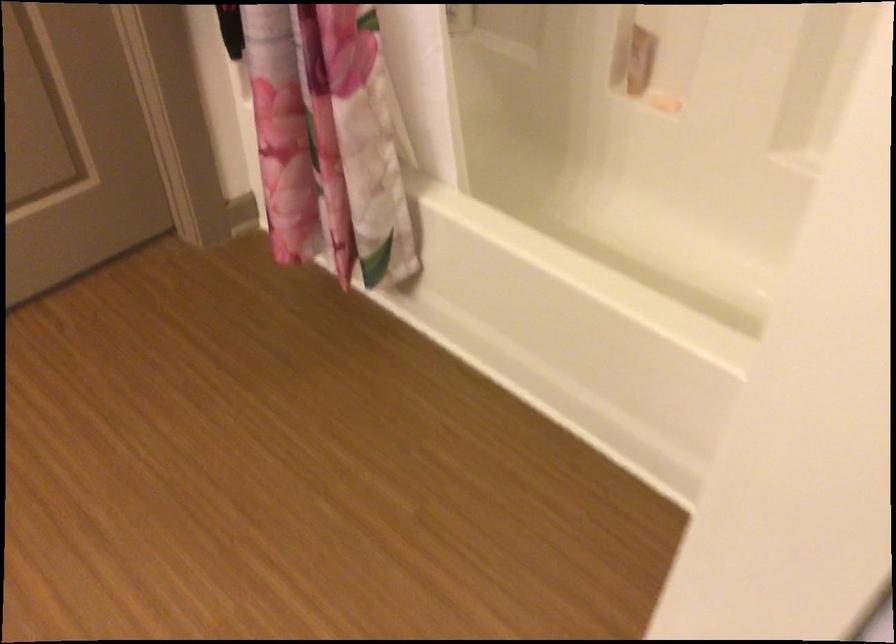
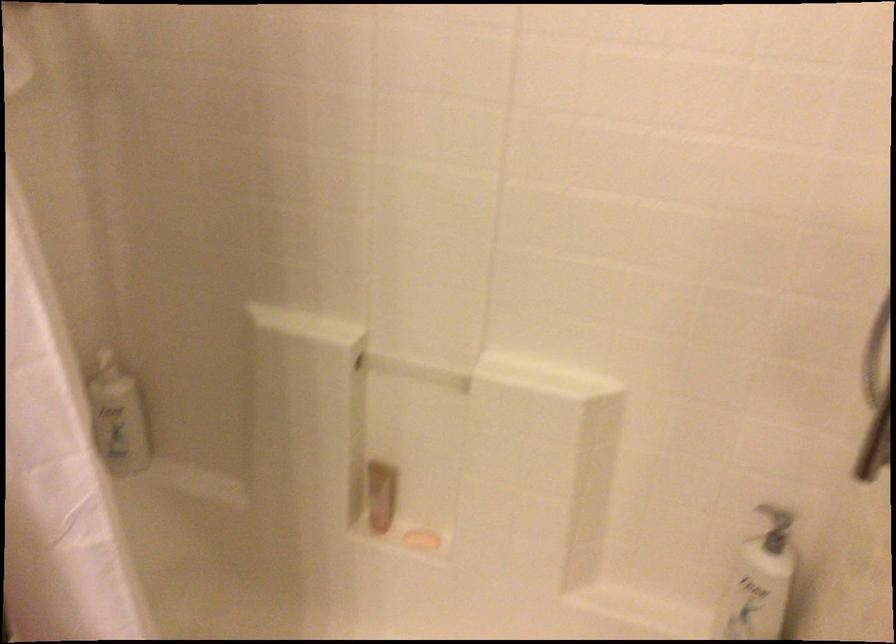
Where in the second image is the point corresponding to [651,88] from the first image?

(421, 540)